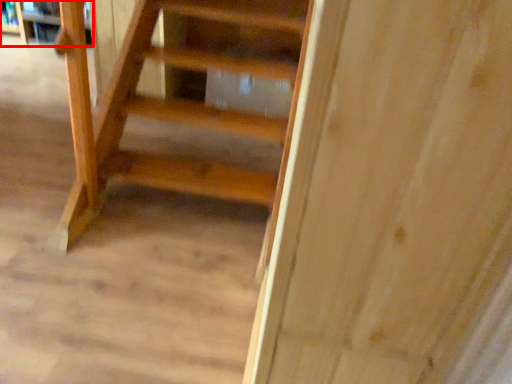
Question: From the image's perspective, considering the relative positions of shelf (annotated by the red box) and book in the image provided, where is shelf (annotated by the red box) located with respect to the staircase?

Choices:
 (A) below
 (B) above

Answer: (B)